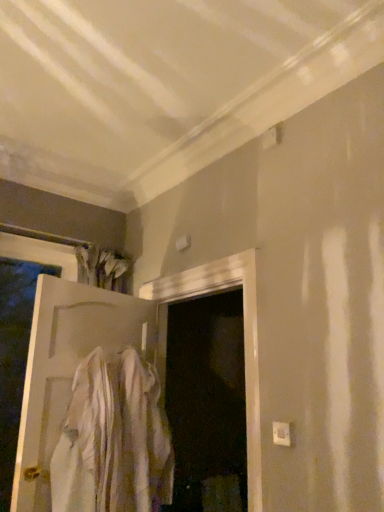
Describe the element at coordinates (113, 439) in the screenshot. I see `white cotton shirt at center` at that location.

I want to click on white cotton shirt at center, so click(113, 439).

The height and width of the screenshot is (512, 384). Find the location of `white matte door at left`. white matte door at left is located at coordinates (67, 368).

The height and width of the screenshot is (512, 384). What do you see at coordinates (67, 368) in the screenshot?
I see `white matte door at left` at bounding box center [67, 368].

Locate an element on the screen. This screenshot has height=512, width=384. white cotton shirt at center is located at coordinates (113, 439).

Which object is positioned more to the left, white cotton shirt at center or white matte door at left?

white matte door at left.

Is the depth of white cotton shirt at center greater than that of white matte door at left?

No, white cotton shirt at center is closer to the camera.

Between point (124, 451) and point (97, 322), which one is positioned behind?

The point (97, 322) is farther.

From the image's perspective, is white cotton shirt at center located above or below white matte door at left?

white cotton shirt at center is below white matte door at left.

From a real-world perspective, which is physically above, white cotton shirt at center or white matte door at left?

In real-world perspective, white matte door at left is above.

Is white cotton shirt at center thinner than white matte door at left?

No.

Is white cotton shirt at center taller or shorter than white matte door at left?

Considering their sizes, white cotton shirt at center has less height than white matte door at left.

Which of these two, white cotton shirt at center or white matte door at left, is smaller?

Smaller between the two is white cotton shirt at center.

Is white matte door at left a part of white cotton shirt at center?

Actually, white matte door at left is outside white cotton shirt at center.

Is white cotton shirt at center next to white matte door at left?

No, white cotton shirt at center is not making contact with white matte door at left.

Is white cotton shirt at center looking in the opposite direction of white matte door at left?

Yes, white cotton shirt at center is positioned with its back facing white matte door at left.

How far apart are white cotton shirt at center and white matte door at left?

white cotton shirt at center and white matte door at left are 8.67 inches apart.

The width and height of the screenshot is (384, 512). What are the coordinates of `clothing below the white matte door at left (from a real-world perspective)` in the screenshot? It's located at (113, 439).

Which object is positioned more to the left, white matte door at left or white cotton shirt at center?

white matte door at left.

Consider the image. Which object is more forward, white matte door at left or white cotton shirt at center?

Positioned in front is white cotton shirt at center.

Is point (58, 313) behind point (87, 423)?

Yes, point (58, 313) is behind point (87, 423).

From the image's perspective, does white matte door at left appear lower than white cotton shirt at center?

No, from the image's perspective, white matte door at left is not below white cotton shirt at center.

Based on the photo, from a real-world perspective, is white matte door at left physically below white cotton shirt at center?

No, from a real-world perspective, white matte door at left is not under white cotton shirt at center.

Considering the sizes of white matte door at left and white cotton shirt at center in the image, is white matte door at left wider or thinner than white cotton shirt at center?

white matte door at left is thinner than white cotton shirt at center.

Considering the relative sizes of white matte door at left and white cotton shirt at center in the image provided, is white matte door at left shorter than white cotton shirt at center?

No.

Considering the sizes of objects white matte door at left and white cotton shirt at center in the image provided, who is smaller, white matte door at left or white cotton shirt at center?

Smaller between the two is white cotton shirt at center.

Is white cotton shirt at center a part of white matte door at left?

No, white cotton shirt at center is not inside white matte door at left.

Can you see white matte door at left touching white cotton shirt at center?

No, white matte door at left is not with white cotton shirt at center.

Is white matte door at left aimed at white cotton shirt at center?

Yes, white matte door at left is turned towards white cotton shirt at center.

You are a GUI agent. You are given a task and a screenshot of the screen. Output one action in this format:
    pyautogui.click(x=<x>, y=<y>)
    Task: Click on the clothing below the white matte door at left (from the image's perspective)
    The image size is (384, 512).
    Given the screenshot: What is the action you would take?
    pyautogui.click(x=113, y=439)

Where is `door lying behind the white cotton shirt at center`? This screenshot has width=384, height=512. door lying behind the white cotton shirt at center is located at coordinates (67, 368).

The image size is (384, 512). Find the location of `door on the left of white cotton shirt at center`. door on the left of white cotton shirt at center is located at coordinates (67, 368).